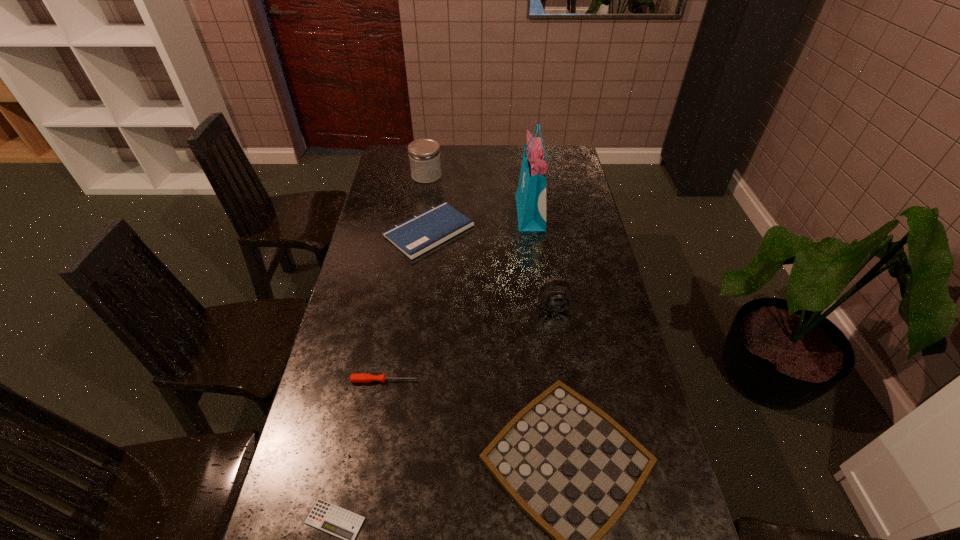
The height and width of the screenshot is (540, 960). Find the location of `the tallest object`. the tallest object is located at coordinates (531, 194).

In order to click on jar in this screenshot , I will do `click(424, 154)`.

This screenshot has width=960, height=540. Find the location of `the sixth shortest object`. the sixth shortest object is located at coordinates (424, 154).

This screenshot has height=540, width=960. What are the coordinates of `the fifth shortest object` in the screenshot? It's located at (556, 295).

This screenshot has height=540, width=960. In order to click on telephoto lens in this screenshot , I will do point(556,295).

In order to click on the fourth tallest object in this screenshot , I will do `click(417, 235)`.

At what (x,y) coordinates should I click in order to perform the action: click on screwdriver. Please return your answer as a coordinate pair (x, y). Looking at the image, I should click on (360, 377).

The width and height of the screenshot is (960, 540). What are the coordinates of `vacant space positioned 0.060m on the back of the tallest object` in the screenshot? It's located at (527, 186).

Image resolution: width=960 pixels, height=540 pixels. I want to click on vacant region located 0.270m on the right of the jar, so click(503, 176).

Where is `vacant space located 0.360m on the front-facing side of the third tallest object`? The height and width of the screenshot is (540, 960). vacant space located 0.360m on the front-facing side of the third tallest object is located at coordinates (573, 423).